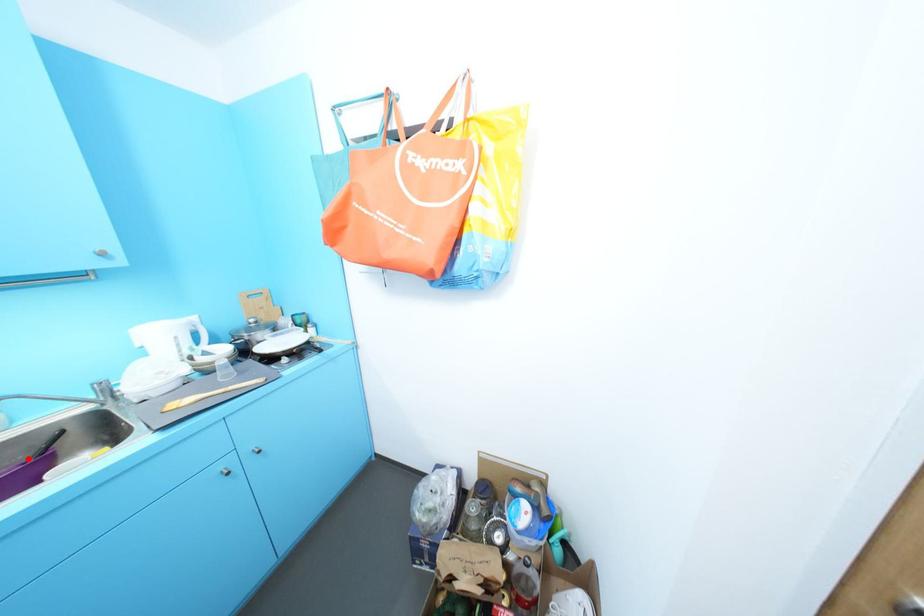
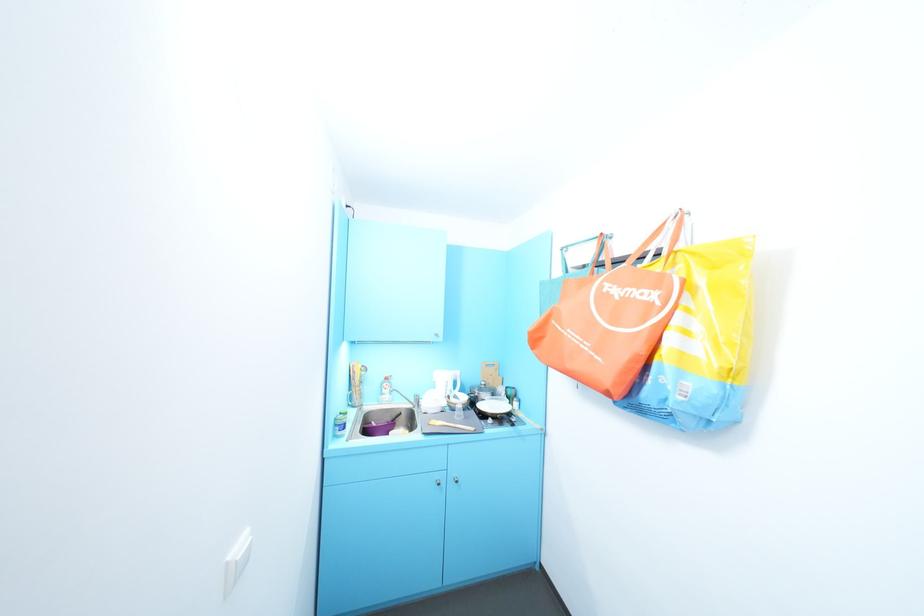
Locate, in the second image, the point that corresponds to the highlighted location in the first image.

(395, 419)